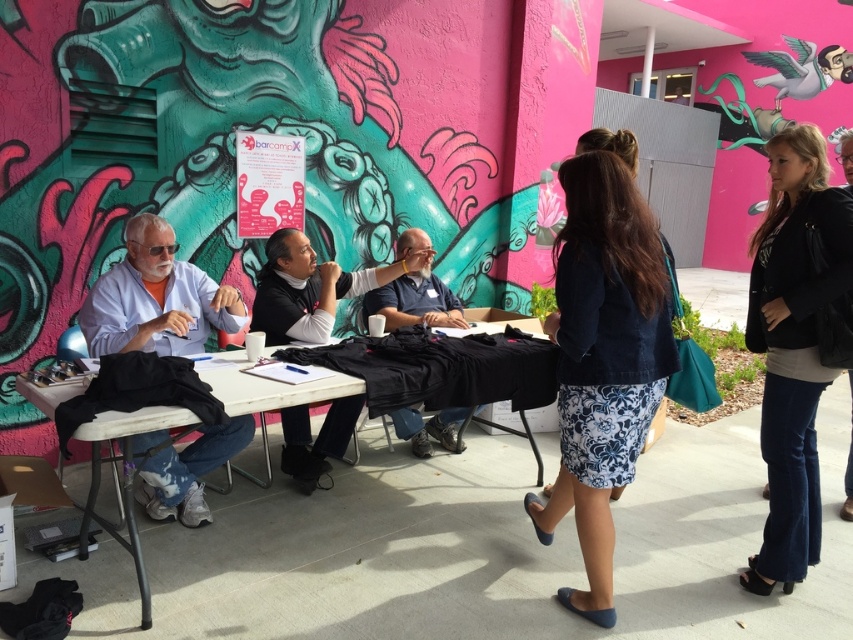
Based on the photo, between light blue shirt at left and white wood table at lower left, which one has less height?

light blue shirt at left

The height and width of the screenshot is (640, 853). What do you see at coordinates (155, 298) in the screenshot?
I see `light blue shirt at left` at bounding box center [155, 298].

Locate an element on the screen. The width and height of the screenshot is (853, 640). light blue shirt at left is located at coordinates click(x=155, y=298).

Describe the element at coordinates (602, 358) in the screenshot. I see `blue floral skirt at center` at that location.

Between blue floral skirt at center and matte blue shirt at center, which one has less height?

With less height is matte blue shirt at center.

Which is behind, point (599, 180) or point (436, 307)?

Point (436, 307)

Locate an element on the screen. The height and width of the screenshot is (640, 853). blue floral skirt at center is located at coordinates (602, 358).

Is blue floral skirt at center bigger than white wood table at lower left?

No.

Can you confirm if blue floral skirt at center is positioned below white wood table at lower left?

No, blue floral skirt at center is not below white wood table at lower left.

Where is `blue floral skirt at center`? blue floral skirt at center is located at coordinates pos(602,358).